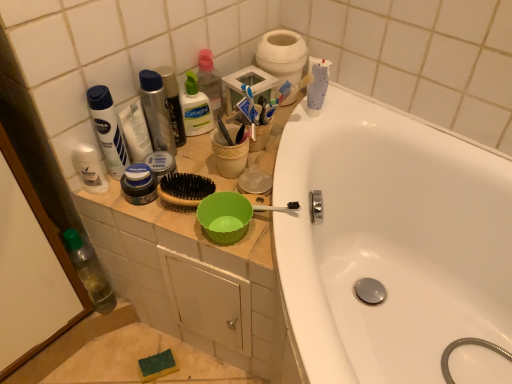
Identify the location of free spot in front of translucent plastic bottle at upper center. (193, 162).